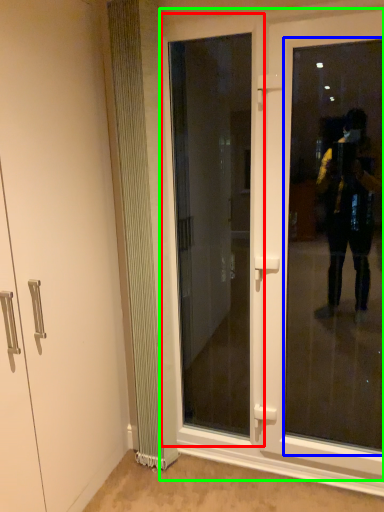
Question: Considering the real-world distances, which object is closest to door (highlighted by a red box)? window screen (highlighted by a blue box) or door (highlighted by a green box).

Choices:
 (A) window screen
 (B) door

Answer: (A)